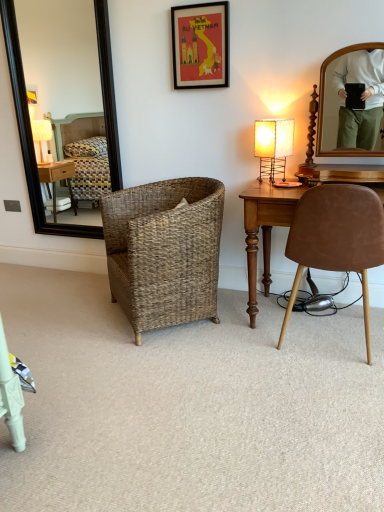
Question: Does black framed mirror at left have a greater width compared to matte beige lamp at right?

Choices:
 (A) no
 (B) yes

Answer: (A)

Question: Can you confirm if black framed mirror at left is bigger than matte beige lamp at right?

Choices:
 (A) yes
 (B) no

Answer: (A)

Question: Is black framed mirror at left directly adjacent to matte beige lamp at right?

Choices:
 (A) no
 (B) yes

Answer: (A)

Question: Are black framed mirror at left and matte beige lamp at right far apart?

Choices:
 (A) no
 (B) yes

Answer: (B)

Question: Is black framed mirror at left not within matte beige lamp at right?

Choices:
 (A) yes
 (B) no

Answer: (A)

Question: In terms of size, does woven brown basket at center, which ranks as the second chair in right-to-left order, appear bigger or smaller than black framed mirror at left?

Choices:
 (A) small
 (B) big

Answer: (B)

Question: From a real-world perspective, is woven brown basket at center, which ranks as the second chair in right-to-left order, positioned above or below black framed mirror at left?

Choices:
 (A) below
 (B) above

Answer: (A)

Question: Is woven brown basket at center, which ranks as the second chair in right-to-left order, to the left or to the right of black framed mirror at left in the image?

Choices:
 (A) right
 (B) left

Answer: (A)

Question: Is point (119, 252) closer or farther from the camera than point (18, 65)?

Choices:
 (A) farther
 (B) closer

Answer: (B)

Question: From a real-world perspective, is matte beige lamp at right above or below black framed mirror at left?

Choices:
 (A) below
 (B) above

Answer: (A)

Question: Is matte beige lamp at right in front of or behind black framed mirror at left in the image?

Choices:
 (A) front
 (B) behind

Answer: (A)

Question: From the image's perspective, is matte beige lamp at right located above or below black framed mirror at left?

Choices:
 (A) above
 (B) below

Answer: (B)

Question: Looking at their shapes, would you say matte beige lamp at right is wider or thinner than black framed mirror at left?

Choices:
 (A) thin
 (B) wide

Answer: (B)

Question: Would you say black framed mirror at left is to the left or to the right of woven basket at center in the picture?

Choices:
 (A) right
 (B) left

Answer: (B)

Question: Based on their sizes in the image, would you say black framed mirror at left is bigger or smaller than woven basket at center?

Choices:
 (A) big
 (B) small

Answer: (B)